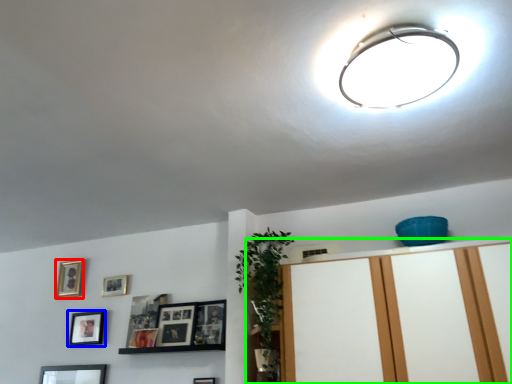
Question: Which object is positioned closest to picture frame (highlighted by a red box)? Select from picture frame (highlighted by a blue box) and dresser (highlighted by a green box).

Choices:
 (A) picture frame
 (B) dresser

Answer: (A)